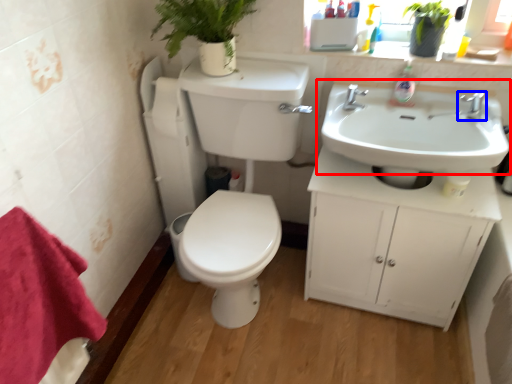
Question: Which of the following is the farthest to the observer, sink (highlighted by a red box) or tap (highlighted by a blue box)?

Choices:
 (A) sink
 (B) tap

Answer: (B)